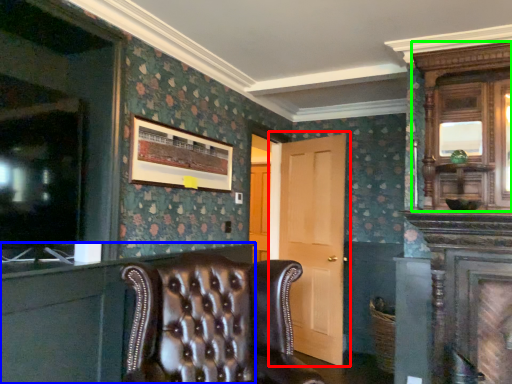
Question: Estimate the real-world distances between objects in this image. Which object is farther from door (highlighted by a red box), dresser (highlighted by a blue box) or armoire (highlighted by a green box)?

Choices:
 (A) dresser
 (B) armoire

Answer: (A)